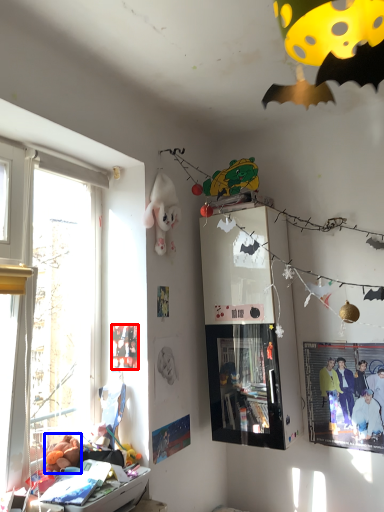
Question: Which point is closer to the camera, poster page (highlighted by a red box) or toy (highlighted by a blue box)?

Choices:
 (A) poster page
 (B) toy

Answer: (B)